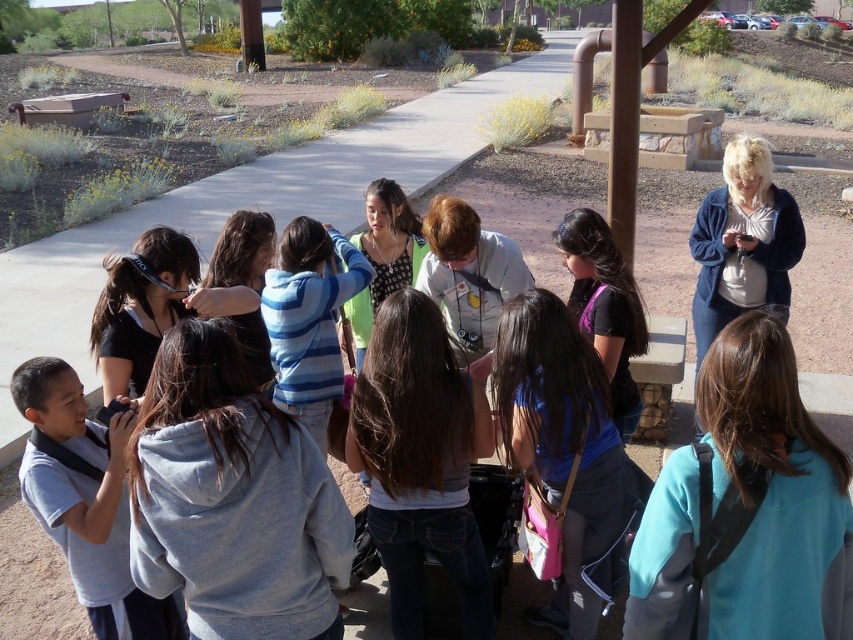
Which is in front, point (502, 392) or point (759, 292)?

Point (502, 392) is in front.

Locate an element on the screen. blue fabric backpack at center is located at coordinates [x=566, y=452].

Between blue striped hoodie at center and black matte shirt at center, which one appears on the left side from the viewer's perspective?

blue striped hoodie at center is more to the left.

From the picture: Between blue striped hoodie at center and black matte shirt at center, which one is positioned lower?

black matte shirt at center

Between point (300, 336) and point (598, 250), which one is positioned in front?

Point (300, 336) is more forward.

This screenshot has height=640, width=853. In order to click on blue striped hoodie at center in this screenshot , I will do `click(309, 317)`.

Does blue fabric backpack at center have a lesser height compared to blue striped hoodie at center?

No, blue fabric backpack at center is not shorter than blue striped hoodie at center.

Who is more distant from viewer, (544,490) or (270,276)?

The point (270,276) is more distant.

The width and height of the screenshot is (853, 640). I want to click on blue fabric backpack at center, so click(566, 452).